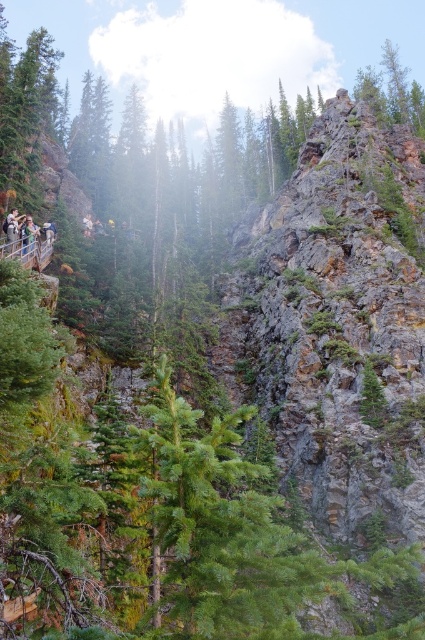
Does matte black backpack at left appear under light brown wooden railing at left?

Indeed, matte black backpack at left is positioned under light brown wooden railing at left.

Who is taller, matte black backpack at left or light brown wooden railing at left?

With more height is matte black backpack at left.

Find the location of a particular element. Image resolution: width=425 pixels, height=640 pixels. matte black backpack at left is located at coordinates (27, 237).

Is point (10, 230) positioned after point (28, 237)?

Yes, it is behind point (28, 237).

Is point (8, 234) positioned in front of point (36, 232)?

Yes, it is in front of point (36, 232).

Locate an element on the screen. The image size is (425, 640). light brown wooden signpost at left is located at coordinates (11, 227).

Can you confirm if matte black backpack at left is wider than light brown wooden signpost at left?

Yes, matte black backpack at left is wider than light brown wooden signpost at left.

Can you confirm if matte black backpack at left is thinner than light brown wooden signpost at left?

No, matte black backpack at left is not thinner than light brown wooden signpost at left.

This screenshot has width=425, height=640. In order to click on matte black backpack at left in this screenshot , I will do `click(27, 237)`.